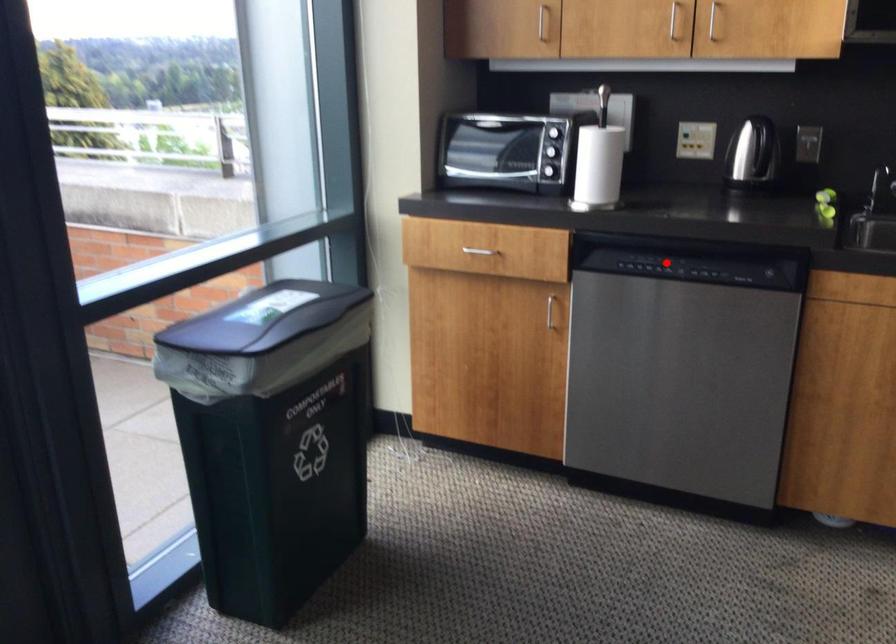
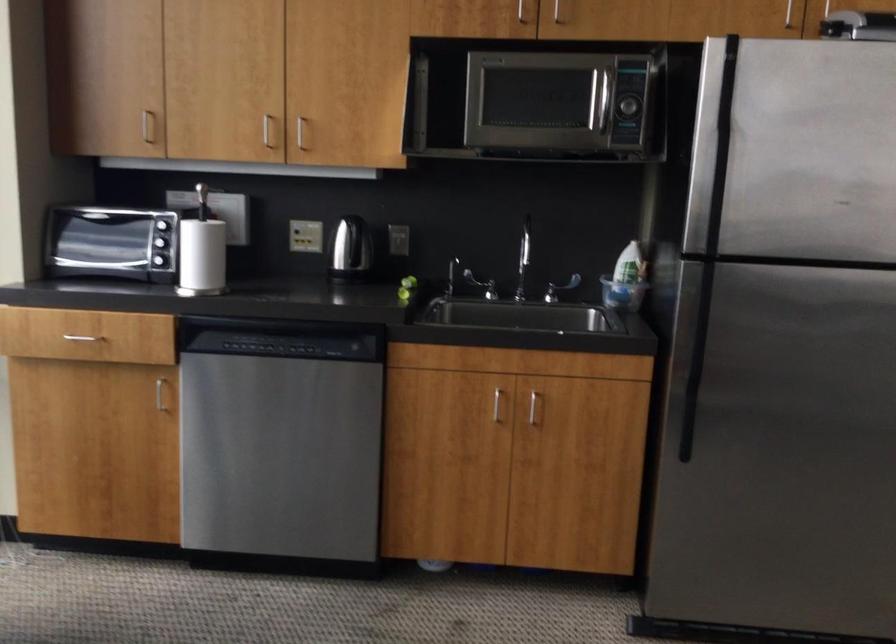
The point at the highlighted location is marked in the first image. Where is the corresponding point in the second image?

(277, 346)